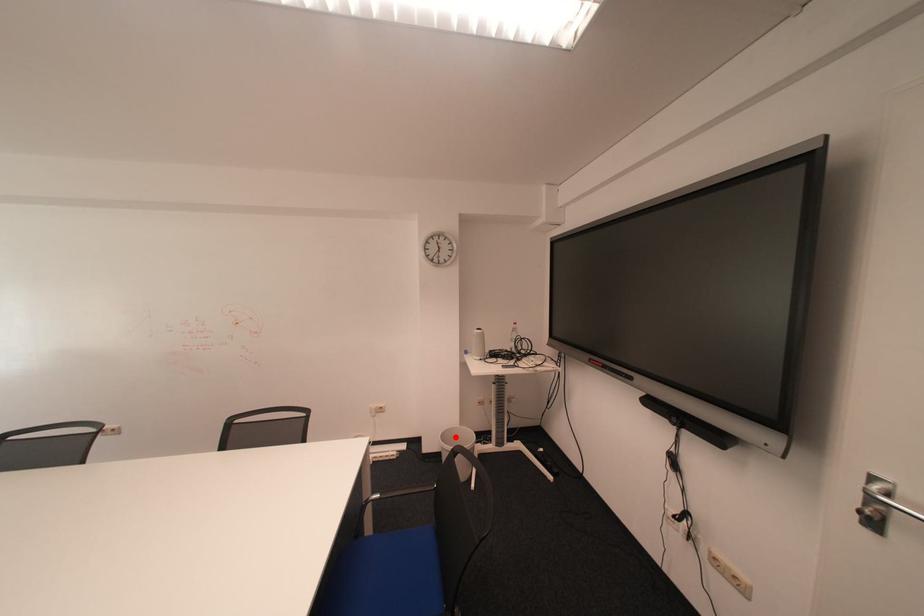
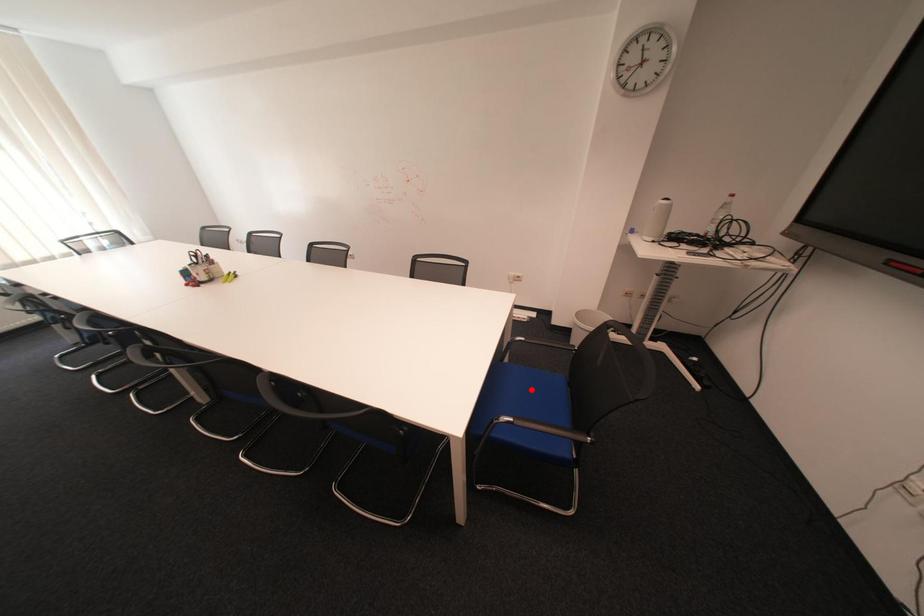
I am providing you with two images of the same scene from different viewpoints. A red point is marked on the first image and another point is marked on the second image. Are the points marked in image1 and image2 representing the same 3D position?

No